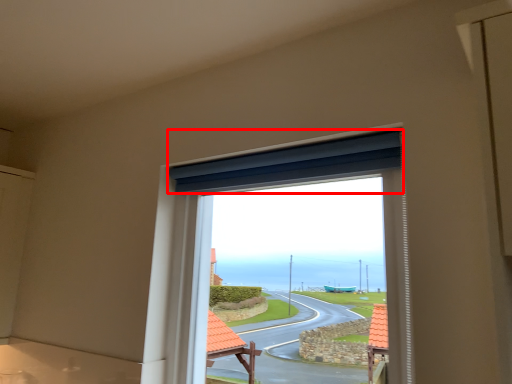
Question: Observing the image, what is the correct spatial positioning of curtain (annotated by the red box) in reference to window?

Choices:
 (A) right
 (B) left

Answer: (B)